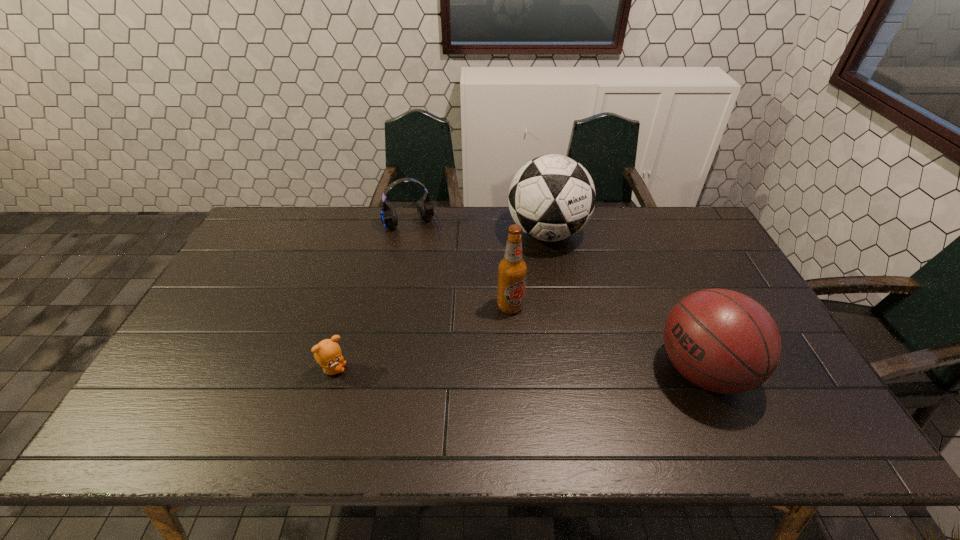
Identify the location of the second closest object relative to the third shortest object. (512, 269).

Select which object appears as the fourth closest to the headset. Please provide its 2D coordinates. Your answer should be formatted as a tuple, i.e. [(x, y)], where the tuple contains the x and y coordinates of a point satisfying the conditions above.

[(723, 341)]

Locate an element on the screen. vacant space that satisfies the following two spatial constraints: 1. on the front side of the soccer ball; 2. on the right side of the rightmost object is located at coordinates (572, 370).

Image resolution: width=960 pixels, height=540 pixels. Find the location of `vacant point that satisfies the following two spatial constraints: 1. on the back side of the beer bottle; 2. on the right side of the soccer ball`. vacant point that satisfies the following two spatial constraints: 1. on the back side of the beer bottle; 2. on the right side of the soccer ball is located at coordinates (505, 233).